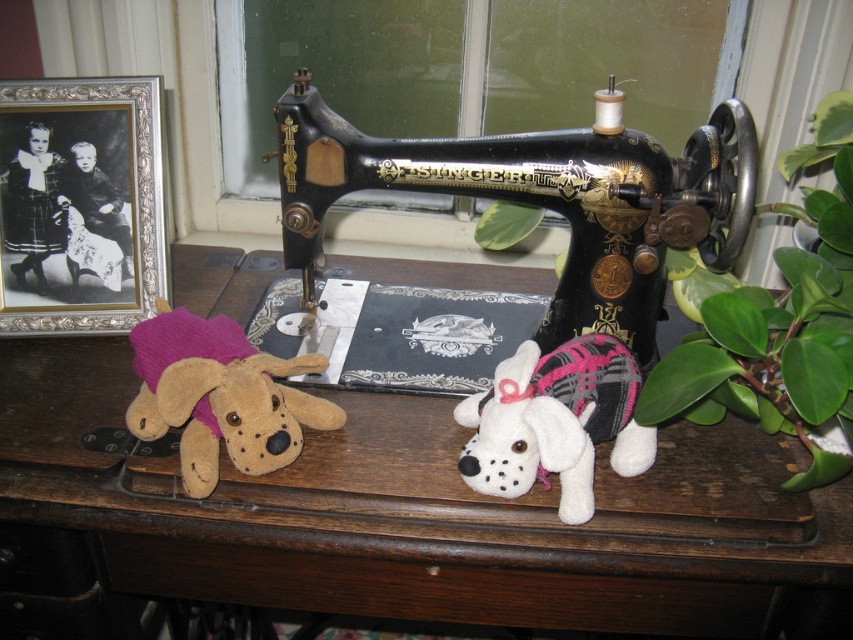
What are the coordinates of the black polished wood sewing machine at center?

The coordinates of the black polished wood sewing machine at center are at point (543, 198).

You are organizing a small display on a table and need to place a decorative item between the green leafy plant at right and the white plush dog at center. Based on their positions, where should you place the item to ensure it is between them?

The green leafy plant at right is located above the white plush dog at center, so placing the decorative item between them would require positioning it below the green leafy plant at right and above the white plush dog at center.

Looking at this image, you are organizing a small craft fair and need to place a decorative item on the brown wooden table at center. However, there is a fuzzy brown stuffed dog at left currently occupying space on the table. Based on their widths, can the stuffed dog be moved to the right side of the table to make room?

The brown wooden table at center is wider than the fuzzy brown stuffed dog at left. Since the table is wider, moving the fuzzy brown stuffed dog at left to the right side of the table should be possible as there is enough space to accommodate it on either side.